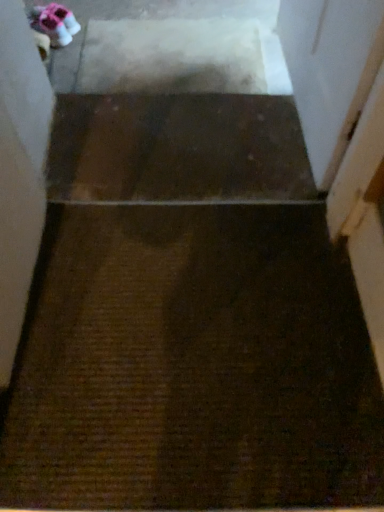
Question: Is transparent plastic screen door at upper right located within brown textured carpet at center?

Choices:
 (A) yes
 (B) no

Answer: (B)

Question: Is brown textured carpet at center shorter than transparent plastic screen door at upper right?

Choices:
 (A) no
 (B) yes

Answer: (B)

Question: Is there a large distance between brown textured carpet at center and transparent plastic screen door at upper right?

Choices:
 (A) no
 (B) yes

Answer: (A)

Question: Is brown textured carpet at center smaller than transparent plastic screen door at upper right?

Choices:
 (A) yes
 (B) no

Answer: (A)

Question: Is brown textured carpet at center closer to the viewer compared to transparent plastic screen door at upper right?

Choices:
 (A) no
 (B) yes

Answer: (A)

Question: Is point (41, 14) positioned closer to the camera than point (177, 103)?

Choices:
 (A) closer
 (B) farther

Answer: (B)

Question: From their relative heights in the image, would you say matte pink fabric shoe at upper left is taller or shorter than brown textured carpet at center?

Choices:
 (A) short
 (B) tall

Answer: (B)

Question: From the image's perspective, is matte pink fabric shoe at upper left located above or below brown textured carpet at center?

Choices:
 (A) above
 (B) below

Answer: (A)

Question: Based on their sizes in the image, would you say matte pink fabric shoe at upper left is bigger or smaller than brown textured carpet at center?

Choices:
 (A) big
 (B) small

Answer: (B)

Question: From the image's perspective, is brown textured carpet at center positioned above or below matte pink fabric shoe at upper left?

Choices:
 (A) above
 (B) below

Answer: (B)

Question: Is brown textured carpet at center inside or outside of matte pink fabric shoe at upper left?

Choices:
 (A) outside
 (B) inside

Answer: (A)

Question: Considering the positions of brown textured carpet at center and matte pink fabric shoe at upper left in the image, is brown textured carpet at center taller or shorter than matte pink fabric shoe at upper left?

Choices:
 (A) short
 (B) tall

Answer: (A)

Question: From a real-world perspective, relative to matte pink fabric shoe at upper left, is brown textured carpet at center vertically above or below?

Choices:
 (A) above
 (B) below

Answer: (A)

Question: Considering the positions of brown textured carpet at center and transparent plastic screen door at upper right in the image, is brown textured carpet at center taller or shorter than transparent plastic screen door at upper right?

Choices:
 (A) short
 (B) tall

Answer: (A)

Question: From a real-world perspective, is brown textured carpet at center positioned above or below transparent plastic screen door at upper right?

Choices:
 (A) above
 (B) below

Answer: (B)